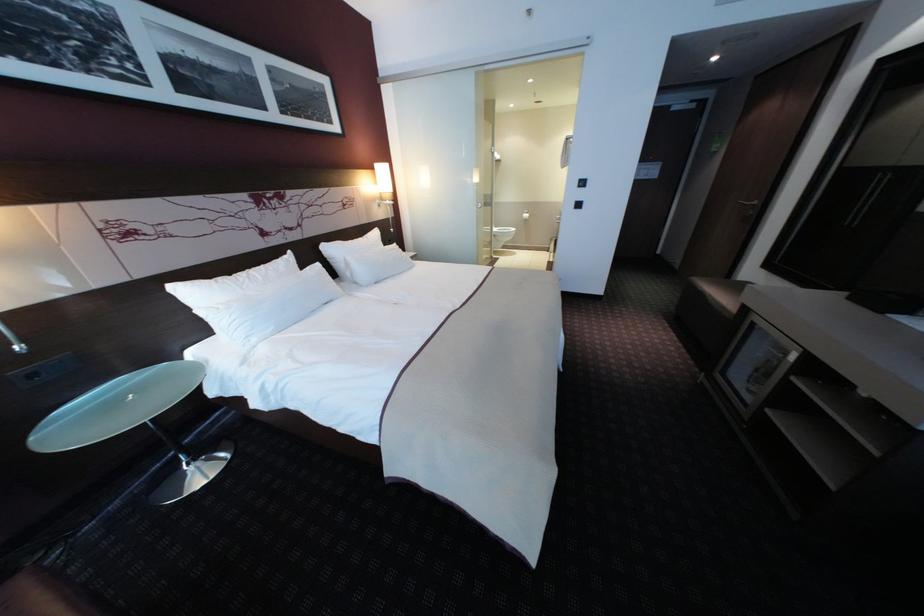
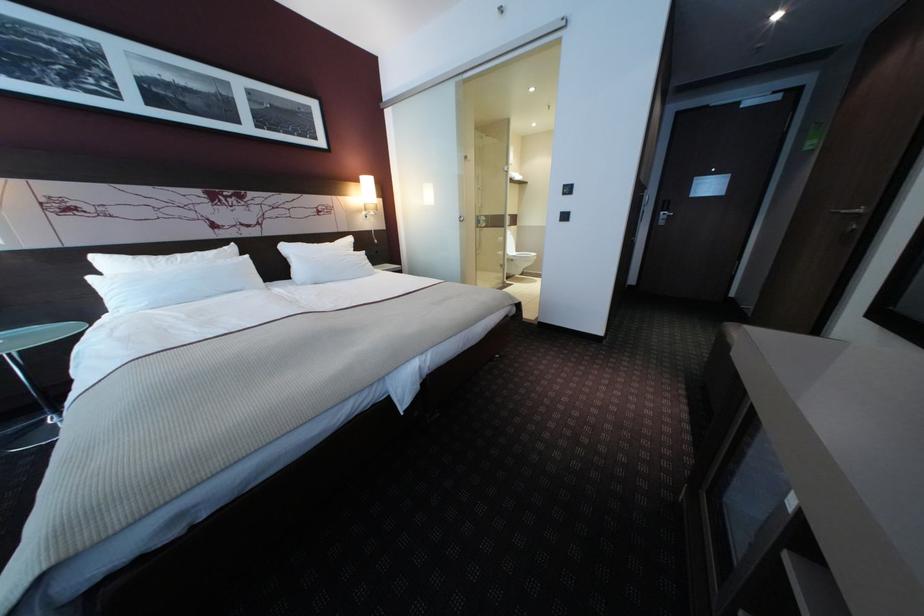
Which direction would the cameraman need to move to produce the second image?

The cameraman walked toward right, forward.